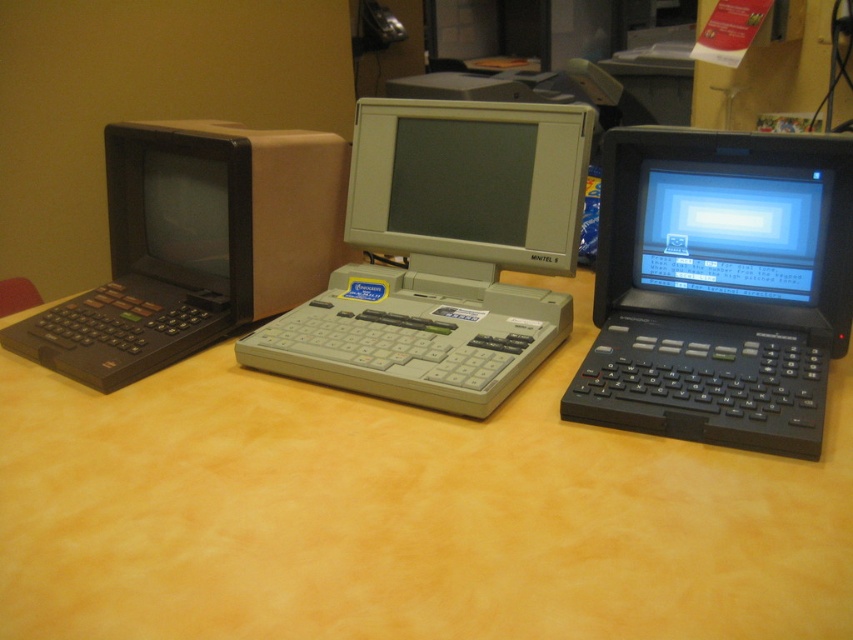
Question: Which of the following is the farthest from the observer?

Choices:
 (A) (605, 288)
 (B) (320, 324)
 (C) (595, 467)
 (D) (323, 257)

Answer: (D)

Question: Is yellow wood table at center below matte black laptop at left?

Choices:
 (A) yes
 (B) no

Answer: (A)

Question: Which object appears closest to the camera in this image?

Choices:
 (A) matte gray monitor at center
 (B) gray plastic computer at center
 (C) matte black laptop at left

Answer: (B)

Question: Is yellow wood table at center positioned at the back of gray plastic computer at center?

Choices:
 (A) no
 (B) yes

Answer: (A)

Question: Is gray plastic computer at center positioned behind matte black laptop at left?

Choices:
 (A) yes
 (B) no

Answer: (B)

Question: Which point is closer to the camera?

Choices:
 (A) black plastic laptop at right
 (B) matte black laptop at left
 (C) matte gray monitor at center

Answer: (A)